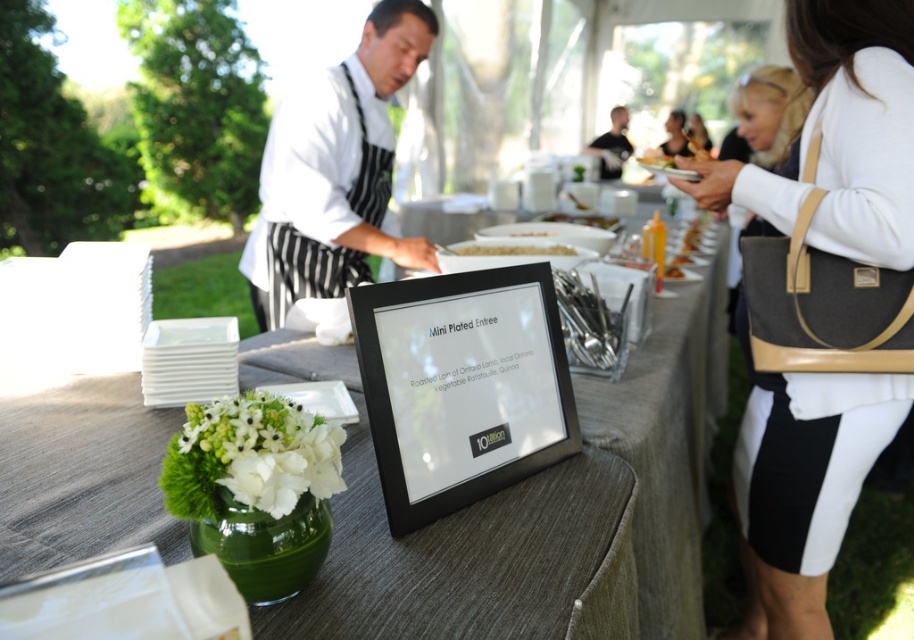
Question: Among these points, which one is nearest to the camera?

Choices:
 (A) pyautogui.click(x=696, y=116)
 (B) pyautogui.click(x=606, y=147)
 (C) pyautogui.click(x=0, y=456)
 (D) pyautogui.click(x=477, y=246)

Answer: (C)

Question: Can you confirm if white apron at center is thinner than dark gray shirt at upper center?

Choices:
 (A) yes
 (B) no

Answer: (B)

Question: Does dark gray shirt at upper center have a greater width compared to white leather handbag at upper right?

Choices:
 (A) no
 (B) yes

Answer: (B)

Question: Is white textured sweater at upper right to the right of smooth white plate at center from the viewer's perspective?

Choices:
 (A) yes
 (B) no

Answer: (A)

Question: Among these points, which one is nearest to the camera?

Choices:
 (A) (614, 115)
 (B) (409, 19)
 (C) (339, 602)
 (D) (570, 244)

Answer: (C)

Question: Which of these objects is positioned closest to the smooth white plate at center?

Choices:
 (A) white apron at center
 (B) white textured sweater at upper right

Answer: (A)